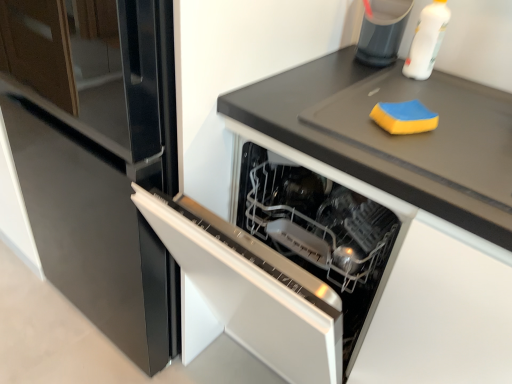
Question: Is white plastic bottle at upper right positioned with its back to yellow sponge at upper right?

Choices:
 (A) no
 (B) yes

Answer: (A)

Question: Can you confirm if white plastic bottle at upper right is bigger than yellow sponge at upper right?

Choices:
 (A) yes
 (B) no

Answer: (A)

Question: From the image's perspective, is white plastic bottle at upper right above yellow sponge at upper right?

Choices:
 (A) yes
 (B) no

Answer: (A)

Question: Considering the relative sizes of white plastic bottle at upper right and yellow sponge at upper right in the image provided, is white plastic bottle at upper right thinner than yellow sponge at upper right?

Choices:
 (A) yes
 (B) no

Answer: (A)

Question: Is yellow sponge at upper right a part of white plastic bottle at upper right?

Choices:
 (A) no
 (B) yes

Answer: (A)

Question: Considering their positions, is white plastic bottle at upper right located in front of or behind yellow sponge at upper right?

Choices:
 (A) front
 (B) behind

Answer: (B)

Question: In the image, is white plastic bottle at upper right on the left side or the right side of yellow sponge at upper right?

Choices:
 (A) right
 (B) left

Answer: (A)

Question: From a real-world perspective, is white plastic bottle at upper right physically located above or below yellow sponge at upper right?

Choices:
 (A) above
 (B) below

Answer: (A)

Question: From their relative heights in the image, would you say white plastic bottle at upper right is taller or shorter than yellow sponge at upper right?

Choices:
 (A) tall
 (B) short

Answer: (A)

Question: Is yellow sponge at upper right wider or thinner than black matte countertop at upper right?

Choices:
 (A) wide
 (B) thin

Answer: (B)

Question: Does point (419, 125) appear closer or farther from the camera than point (431, 163)?

Choices:
 (A) closer
 (B) farther

Answer: (B)

Question: Would you say yellow sponge at upper right is inside or outside black matte countertop at upper right?

Choices:
 (A) inside
 (B) outside

Answer: (B)

Question: Is yellow sponge at upper right taller or shorter than black matte countertop at upper right?

Choices:
 (A) short
 (B) tall

Answer: (A)

Question: From the image's perspective, relative to translucent plastic container at upper right, is black matte countertop at upper right above or below?

Choices:
 (A) below
 (B) above

Answer: (A)

Question: Considering their positions, is black matte countertop at upper right located in front of or behind translucent plastic container at upper right?

Choices:
 (A) front
 (B) behind

Answer: (A)